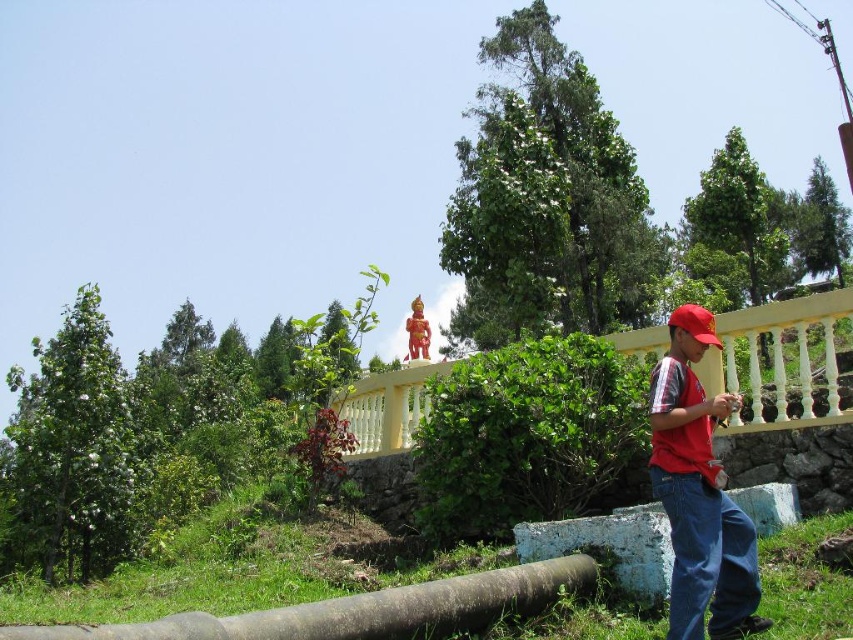
Question: Does yellow painted wood at upper center appear on the left side of brown rubber log at lower center?

Choices:
 (A) yes
 (B) no

Answer: (B)

Question: Can you confirm if yellow painted wood at upper center is thinner than brown rubber log at lower center?

Choices:
 (A) yes
 (B) no

Answer: (B)

Question: Does red matte shirt at right have a greater width compared to yellow painted wood at upper center?

Choices:
 (A) yes
 (B) no

Answer: (B)

Question: Among these objects, which one is farthest from the camera?

Choices:
 (A) red matte shirt at right
 (B) brown rubber log at lower center

Answer: (A)

Question: Which is nearer to the brown rubber log at lower center?

Choices:
 (A) red matte shirt at right
 (B) yellow painted wood at upper center

Answer: (A)

Question: Which object is the farthest from the red matte shirt at right?

Choices:
 (A) brown rubber log at lower center
 (B) yellow painted wood at upper center

Answer: (B)